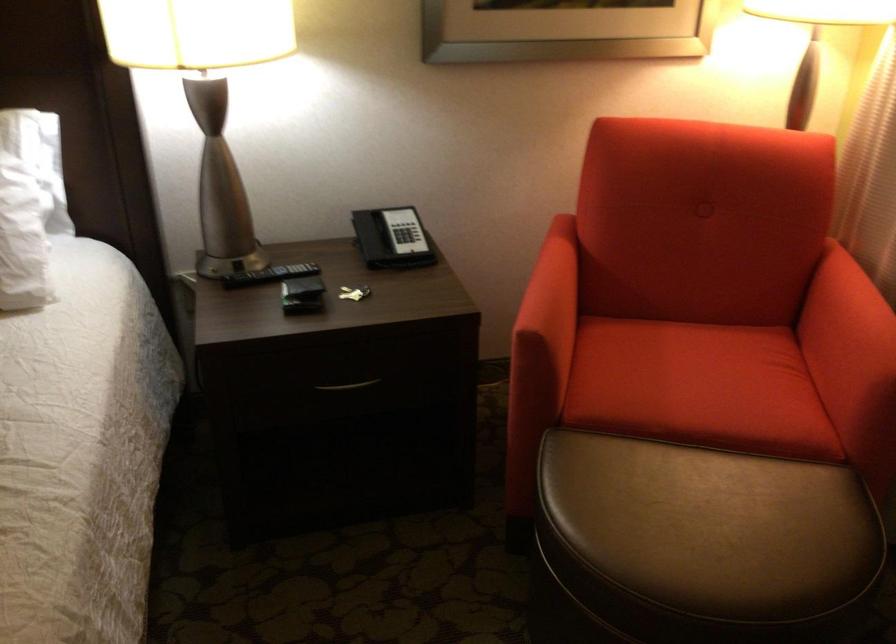
Question: The images are taken continuously from a first-person perspective. In which direction is your viewpoint rotating?

Choices:
 (A) Left
 (B) Right
 (C) Up
 (D) Down

Answer: (B)